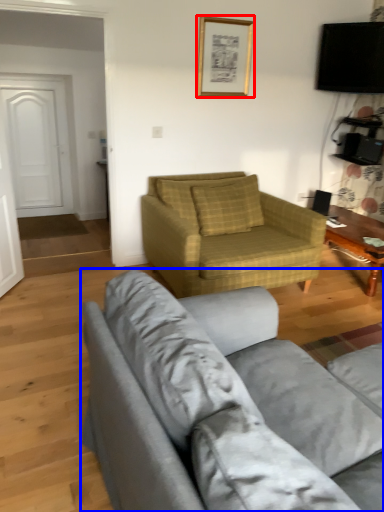
Question: Which of the following is the farthest to the observer, picture frame (highlighted by a red box) or studio couch (highlighted by a blue box)?

Choices:
 (A) picture frame
 (B) studio couch

Answer: (A)